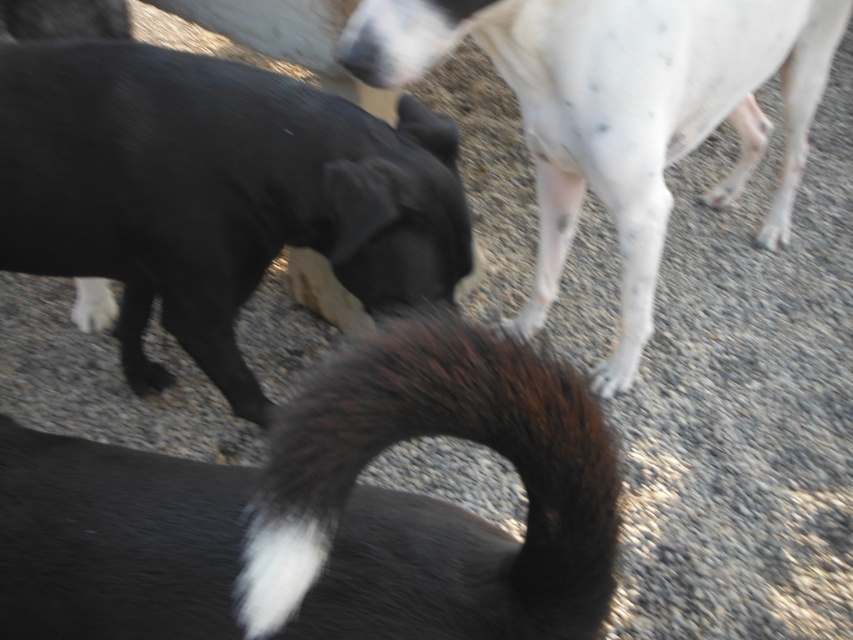
You are a photographer trying to capture a closeup of the foreground dog in the scene. You notice two points marked in the image at coordinates point (601,509) and point (677,93). Which point should you focus on to ensure the foreground dog is in sharp focus?

Point (601,509) is closer to the camera than point (677,93), so focusing on point (601,509) will ensure the foreground dog is in sharp focus.

You are a photographer trying to capture a closeup shot of the foreground dog in the scene. You notice two points marked in the image at coordinates point (x=196, y=124) and point (x=625, y=54). Which point should you focus on to ensure the foreground dog is in sharp focus?

Point (x=196, y=124) is closer to the camera than point (x=625, y=54), so focusing on point (x=196, y=124) will ensure the foreground dog is in sharp focus.